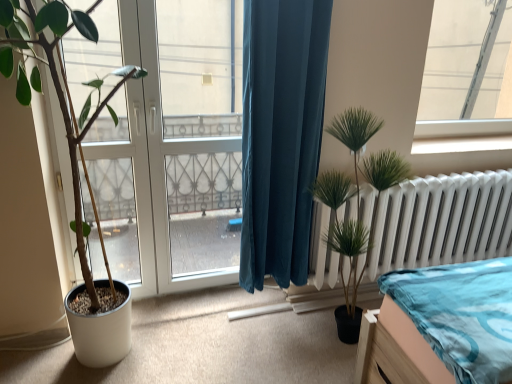
This screenshot has height=384, width=512. What do you see at coordinates (71, 157) in the screenshot?
I see `green matte plant at left, the 1th houseplant from the left` at bounding box center [71, 157].

Looking at this image, measure the distance between white metallic radiator at right and camera.

They are 6.53 feet apart.

What do you see at coordinates (281, 135) in the screenshot? I see `teal velvet curtain at center` at bounding box center [281, 135].

Locate an element on the screen. This screenshot has width=512, height=384. teal velvet curtain at center is located at coordinates (281, 135).

This screenshot has height=384, width=512. Describe the element at coordinates (195, 139) in the screenshot. I see `transparent glass door at center` at that location.

Locate an element on the screen. The image size is (512, 384). transparent glass door at center is located at coordinates (195, 139).

Locate an element on the screen. This screenshot has height=384, width=512. green matte plant at left, the 1th houseplant from the left is located at coordinates (71, 157).

Consider the image. Can you confirm if teal velvet curtain at center is positioned to the right of transparent glass window at upper right?

No, teal velvet curtain at center is not to the right of transparent glass window at upper right.

At what (x,y) coordinates should I click in order to perform the action: click on curtain that appears on the left of transparent glass window at upper right. Please return your answer as a coordinate pair (x, y). The image size is (512, 384). Looking at the image, I should click on (281, 135).

From a real-world perspective, who is located lower, teal velvet curtain at center or transparent glass window at upper right?

teal velvet curtain at center, from a real-world perspective.

Could you tell me if teal velvet curtain at center is turned towards transparent glass window at upper right?

No, teal velvet curtain at center is not aimed at transparent glass window at upper right.

From a real-world perspective, relative to transparent glass door at left, is green artificial plant at right, the first houseplant positioned from the right, vertically above or below?

green artificial plant at right, the first houseplant positioned from the right, is below transparent glass door at left.

Considering the relative sizes of green artificial plant at right, the first houseplant positioned from the right, and transparent glass door at left in the image provided, is green artificial plant at right, the first houseplant positioned from the right, shorter than transparent glass door at left?

Correct, green artificial plant at right, the first houseplant positioned from the right, is not as tall as transparent glass door at left.

Is point (346, 304) positioned in front of point (114, 139)?

Yes, point (346, 304) is closer to viewer.

Can we say green artificial plant at right, which appears as the second houseplant when viewed from the left, lies outside transparent glass door at left?

Absolutely, green artificial plant at right, which appears as the second houseplant when viewed from the left, is external to transparent glass door at left.

Does point (437, 83) lie in front of point (215, 20)?

Yes, it is in front of point (215, 20).

Does transparent glass window at upper right have a greater width compared to transparent glass door at center?

No.

Can you tell me how much transparent glass window at upper right and transparent glass door at center differ in facing direction?

There is a 2.33-degree angle between the facing directions of transparent glass window at upper right and transparent glass door at center.

Is white metallic radiator at right at the left side of transparent glass door at left?

No, white metallic radiator at right is not to the left of transparent glass door at left.

Considering the positions of points (319, 237) and (186, 143), is point (319, 237) closer to camera compared to point (186, 143)?

Yes, it is in front of point (186, 143).

In terms of size, does white metallic radiator at right appear bigger or smaller than transparent glass door at left?

Considering their sizes, white metallic radiator at right takes up more space than transparent glass door at left.

Is teal velvet curtain at center inside the boundaries of white metallic radiator at right, or outside?

teal velvet curtain at center is spatially situated outside white metallic radiator at right.

Who is bigger, teal velvet curtain at center or white metallic radiator at right?

teal velvet curtain at center.

Where is `radiator behind the teal velvet curtain at center`? radiator behind the teal velvet curtain at center is located at coordinates (439, 221).

Is point (303, 193) farther from viewer compared to point (310, 267)?

No, it is not.

Which is behind, point (192, 171) or point (254, 238)?

The point (192, 171) is farther.

Does transparent glass door at center lie behind teal velvet curtain at center?

Yes, transparent glass door at center is further from the camera.

Is transparent glass door at center aimed at teal velvet curtain at center?

Yes, transparent glass door at center faces towards teal velvet curtain at center.

Can you confirm if transparent glass door at center is shorter than teal velvet curtain at center?

Incorrect, the height of transparent glass door at center does not fall short of that of teal velvet curtain at center.

Is green matte plant at left, the 1th houseplant from the left, not close to transparent glass door at left?

green matte plant at left, the 1th houseplant from the left, is near transparent glass door at left, not far away.

From the picture: Is green matte plant at left, positioned as the 2th houseplant in right-to-left order, oriented towards transparent glass door at left?

No.

Find the location of a particular element. bay window on the right of green matte plant at left, the 1th houseplant from the left is located at coordinates (161, 147).

You are a GUI agent. You are given a task and a screenshot of the screen. Output one action in this format:
    pyautogui.click(x=<x>, y=<y>)
    Task: Click on the window lying behind the teal velvet curtain at center
    The height and width of the screenshot is (384, 512).
    Given the screenshot: What is the action you would take?
    pyautogui.click(x=465, y=77)

From the image's perspective, which houseplant is the 2nd one below the transparent glass door at left? Please provide its 2D coordinates.

[(357, 204)]

From the image, which object appears to be nearer to green matte plant at left, positioned as the 2th houseplant in right-to-left order, transparent glass door at left or white metallic radiator at right?

transparent glass door at left.

Which object lies nearer to the anchor point transparent glass door at left, teal velvet curtain at center or transparent glass door at center?

transparent glass door at center is closer to transparent glass door at left.

Estimate the real-world distances between objects in this image. Which object is closer to green matte plant at left, positioned as the 2th houseplant in right-to-left order, transparent glass door at center or white metallic radiator at right?

The object closer to green matte plant at left, positioned as the 2th houseplant in right-to-left order, is transparent glass door at center.

When comparing their distances from white metallic radiator at right, does green matte plant at left, the 1th houseplant from the left, or transparent glass door at center seem further?

green matte plant at left, the 1th houseplant from the left, is further to white metallic radiator at right.

Looking at the image, which one is located further to white metallic radiator at right, transparent glass door at center or green matte plant at left, positioned as the 2th houseplant in right-to-left order?

green matte plant at left, positioned as the 2th houseplant in right-to-left order, is positioned further to the anchor white metallic radiator at right.

Considering their positions, is green matte plant at left, positioned as the 2th houseplant in right-to-left order, positioned further to green artificial plant at right, the first houseplant positioned from the right, than white metallic radiator at right?

Among the two, green matte plant at left, positioned as the 2th houseplant in right-to-left order, is located further to green artificial plant at right, the first houseplant positioned from the right.

From the image, which object appears to be farther from white metallic radiator at right, green artificial plant at right, the first houseplant positioned from the right, or transparent glass door at center?

Among the two, transparent glass door at center is located further to white metallic radiator at right.

Which object lies further to the anchor point green artificial plant at right, the first houseplant positioned from the right, transparent glass door at left or teal velvet curtain at center?

transparent glass door at left.

You are a GUI agent. You are given a task and a screenshot of the screen. Output one action in this format:
    pyautogui.click(x=<x>, y=<y>)
    Task: Click on the curtain between transparent glass door at center and green artificial plant at right, which appears as the second houseplant when viewed from the left, from left to right
    This screenshot has height=384, width=512.
    Given the screenshot: What is the action you would take?
    pyautogui.click(x=281, y=135)

This screenshot has width=512, height=384. In order to click on radiator between transparent glass window at upper right and green artificial plant at right, the first houseplant positioned from the right, vertically in this screenshot , I will do `click(439, 221)`.

This screenshot has width=512, height=384. Identify the location of curtain located between transparent glass door at center and transparent glass window at upper right in the left-right direction. (281, 135).

Locate an element on the screen. radiator between transparent glass door at center and transparent glass window at upper right from left to right is located at coordinates (439, 221).